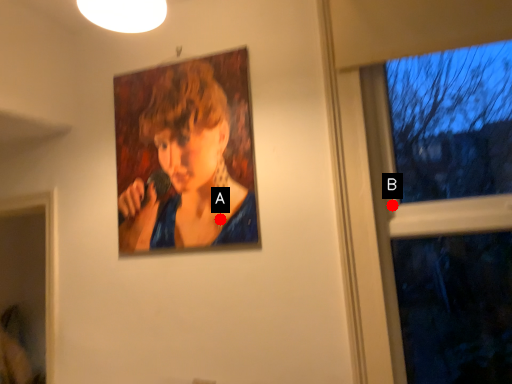
Question: Two points are circled on the image, labeled by A and B beside each circle. Which point is closer to the camera?

Choices:
 (A) A is closer
 (B) B is closer

Answer: (B)